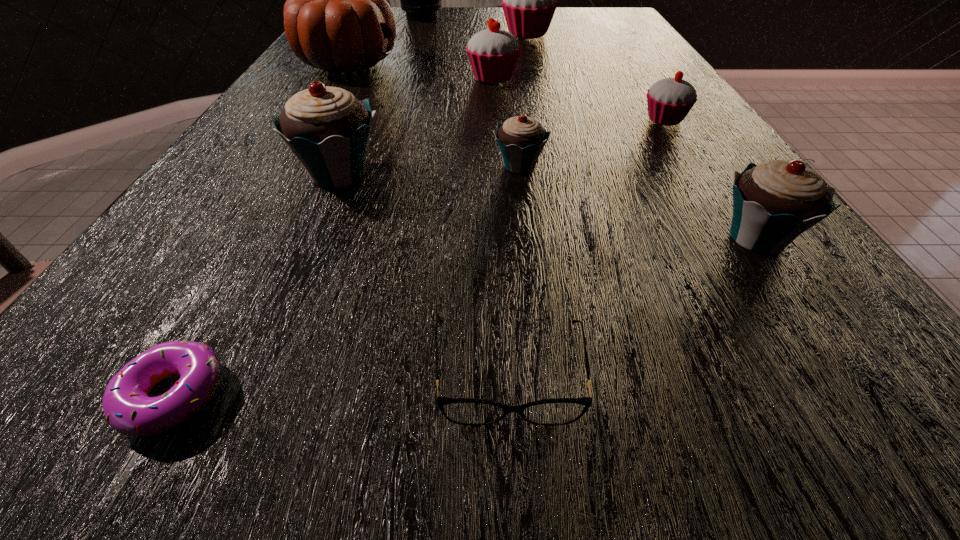
Where is `the second smallest teal cupcake`? The width and height of the screenshot is (960, 540). the second smallest teal cupcake is located at coordinates (773, 203).

Identify the location of the third farthest cupcake. Image resolution: width=960 pixels, height=540 pixels. (669, 100).

Image resolution: width=960 pixels, height=540 pixels. What are the coordinates of `the rightmost pink cupcake` in the screenshot? It's located at (669, 100).

Where is `the second teal cupcake from right to left`? The height and width of the screenshot is (540, 960). the second teal cupcake from right to left is located at coordinates (521, 139).

At what (x,y) coordinates should I click in order to perform the action: click on the ninth tallest object. Please return your answer as a coordinate pair (x, y). The image size is (960, 540). Looking at the image, I should click on (464, 411).

I want to click on doughnut, so click(x=127, y=408).

Identify the location of the shortest object. (127, 408).

Where is `free spot located 0.120m on the right of the telephoto lens`? free spot located 0.120m on the right of the telephoto lens is located at coordinates (486, 17).

Where is `vacant position located on the face of the orange pumpkin`? The height and width of the screenshot is (540, 960). vacant position located on the face of the orange pumpkin is located at coordinates (490, 64).

The height and width of the screenshot is (540, 960). What are the coordinates of `vacant space situated on the left of the farthest cupcake` in the screenshot? It's located at (352, 34).